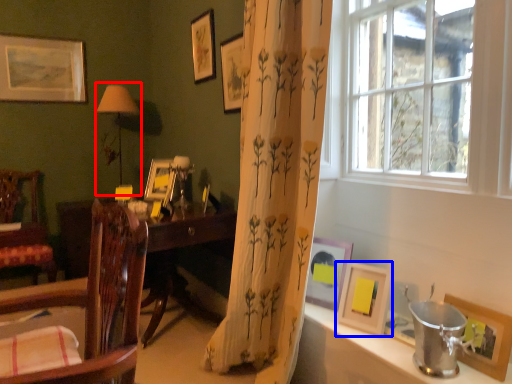
Question: Among these objects, which one is nearest to the camera, table lamp (highlighted by a red box) or picture frame (highlighted by a blue box)?

Choices:
 (A) table lamp
 (B) picture frame

Answer: (B)